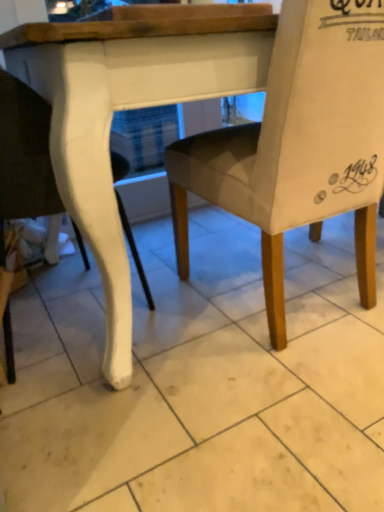
I want to click on vacant area situated below light gray fabric chair at center, the second chair in the left-to-right sequence (from a real-world perspective), so click(285, 308).